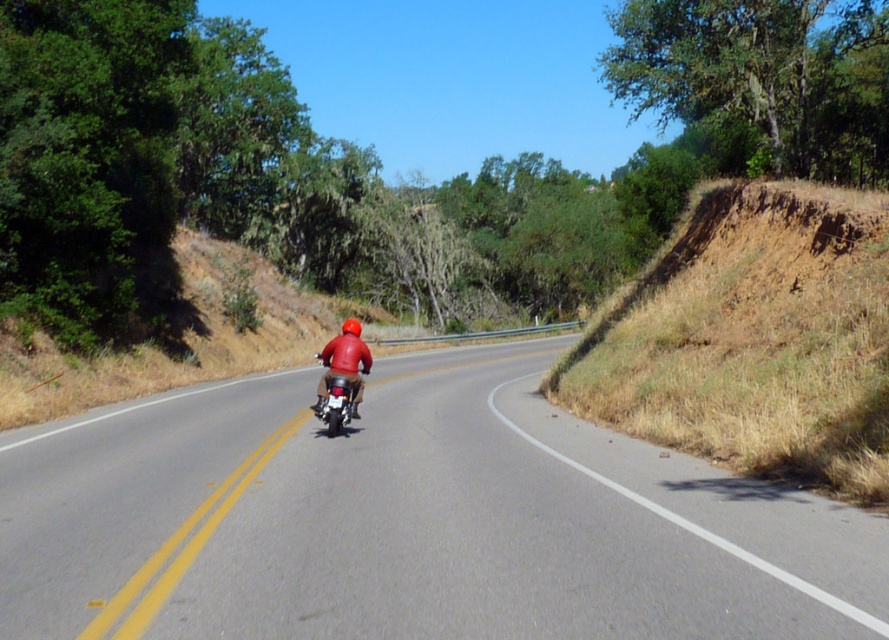
You are a drone operator trying to capture the gray asphalt road at center from above. According to the coordinates provided, where should you position the drone to get the best shot?

The gray asphalt road at center is located at point (410, 522), so the drone should be positioned directly above this coordinate to capture it from above.

You are a photographer positioned at the start of the road. You want to capture both the dry grass at right and the matte red helmet at center in your shot. Which object will occupy more horizontal space in the photo?

The dry grass at right has a greater width than the matte red helmet at center, so it will occupy more horizontal space in the photo.

You are a cyclist approaching a bend in the road. You see the dry grass at right and the matte red helmet at center. Which object is closer to the bend in the road?

The dry grass at right is to the right of the matte red helmet at center, so the matte red helmet at center is closer to the bend in the road.